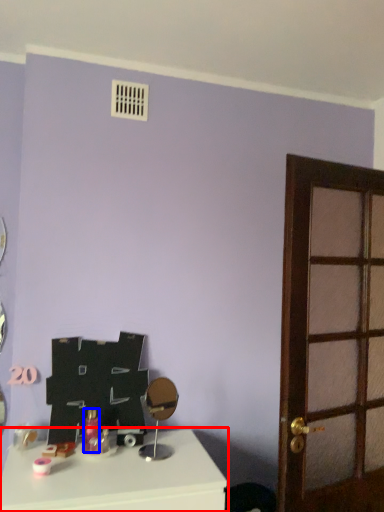
Question: Among these objects, which one is farthest to the camera, table (highlighted by a red box) or toiletry (highlighted by a blue box)?

Choices:
 (A) table
 (B) toiletry

Answer: (B)